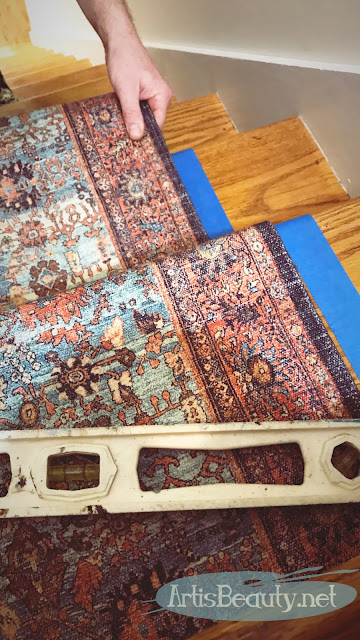
Find the location of a particular element. blue painter's tape is located at coordinates (310, 267), (187, 173).